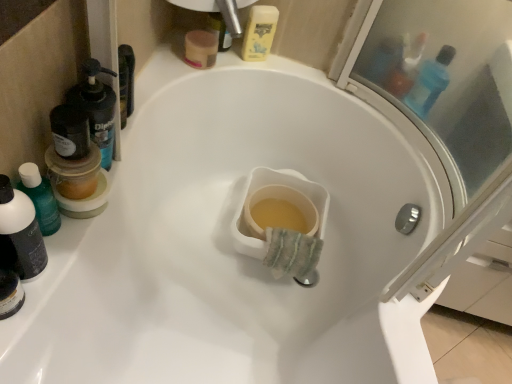
What do you see at coordinates (20, 233) in the screenshot? I see `translucent plastic mouthwash at left, acting as the 1th mouthwash starting from the bottom` at bounding box center [20, 233].

How much space does yellow plastic mouthwash at upper center, which is the fourth mouthwash in front-to-back order, occupy vertically?

yellow plastic mouthwash at upper center, which is the fourth mouthwash in front-to-back order, is 6.24 inches in height.

What is the approximate height of black plastic mouthwash at left, which is the 3th mouthwash in back-to-front order?

black plastic mouthwash at left, which is the 3th mouthwash in back-to-front order, is 10.17 inches tall.

This screenshot has height=384, width=512. What do you see at coordinates (430, 82) in the screenshot? I see `blue translucent bottle at upper right, the 3th mouthwash positioned from the front` at bounding box center [430, 82].

Where is `translucent plastic mouthwash at left, acting as the 1th mouthwash starting from the bottom`? The height and width of the screenshot is (384, 512). translucent plastic mouthwash at left, acting as the 1th mouthwash starting from the bottom is located at coordinates (20, 233).

Is black plastic mouthwash at left, the 3th mouthwash when ordered from top to bottom, at the back of yellow plastic mouthwash at upper center, which is the first mouthwash in top-to-bottom order?

No, yellow plastic mouthwash at upper center, which is the first mouthwash in top-to-bottom order, is not facing away from black plastic mouthwash at left, the 3th mouthwash when ordered from top to bottom.

Considering the relative positions of yellow plastic mouthwash at upper center, which ranks as the 3th mouthwash in left-to-right order, and black plastic mouthwash at left, the second mouthwash ordered from the bottom, in the image provided, is yellow plastic mouthwash at upper center, which ranks as the 3th mouthwash in left-to-right order, to the left or to the right of black plastic mouthwash at left, the second mouthwash ordered from the bottom,?

yellow plastic mouthwash at upper center, which ranks as the 3th mouthwash in left-to-right order, is to the right of black plastic mouthwash at left, the second mouthwash ordered from the bottom.

Measure the distance from yellow plastic mouthwash at upper center, which is the second mouthwash from right to left, to black plastic mouthwash at left, the 3th mouthwash when ordered from top to bottom.

The distance of yellow plastic mouthwash at upper center, which is the second mouthwash from right to left, from black plastic mouthwash at left, the 3th mouthwash when ordered from top to bottom, is 22.48 inches.

Looking at this image, is yellow plastic mouthwash at upper center, which ranks as the 3th mouthwash in left-to-right order, positioned far away from black plastic mouthwash at left, the second mouthwash positioned from the left?

No, yellow plastic mouthwash at upper center, which ranks as the 3th mouthwash in left-to-right order, is not far away from black plastic mouthwash at left, the second mouthwash positioned from the left.

Which of these two, black plastic mouthwash at left, the 3th mouthwash when ordered from top to bottom, or translucent plastic mouthwash at left, the fourth mouthwash when ordered from back to front, is smaller?

Smaller between the two is translucent plastic mouthwash at left, the fourth mouthwash when ordered from back to front.

Measure the distance from black plastic mouthwash at left, the second mouthwash positioned from the front, to translucent plastic mouthwash at left, acting as the 1th mouthwash starting from the bottom.

They are 7.87 inches apart.

From the image's perspective, is black plastic mouthwash at left, the second mouthwash positioned from the left, under translucent plastic mouthwash at left, the fourth mouthwash viewed from the right?

Actually, black plastic mouthwash at left, the second mouthwash positioned from the left, appears above translucent plastic mouthwash at left, the fourth mouthwash viewed from the right, in the image.

How different are the orientations of black plastic mouthwash at left, the 3th mouthwash when ordered from top to bottom, and translucent plastic mouthwash at left, acting as the 1th mouthwash starting from the bottom, in degrees?

1.33e-05 degrees separate the facing orientations of black plastic mouthwash at left, the 3th mouthwash when ordered from top to bottom, and translucent plastic mouthwash at left, acting as the 1th mouthwash starting from the bottom.

Is black plastic mouthwash at left, the 3th mouthwash when ordered from top to bottom, aimed at yellow plastic mouthwash at upper center, positioned as the 1th mouthwash in back-to-front order?

No, black plastic mouthwash at left, the 3th mouthwash when ordered from top to bottom, is not aimed at yellow plastic mouthwash at upper center, positioned as the 1th mouthwash in back-to-front order.

Is black plastic mouthwash at left, the second mouthwash positioned from the front, in front of or behind yellow plastic mouthwash at upper center, the fourth mouthwash when ordered from bottom to top, in the image?

Visually, black plastic mouthwash at left, the second mouthwash positioned from the front, is located in front of yellow plastic mouthwash at upper center, the fourth mouthwash when ordered from bottom to top.

Does point (89, 124) come closer to viewer compared to point (249, 18)?

That is True.

Which of these two, black plastic mouthwash at left, which is the 3th mouthwash in back-to-front order, or yellow plastic mouthwash at upper center, which is the first mouthwash in top-to-bottom order, is smaller?

yellow plastic mouthwash at upper center, which is the first mouthwash in top-to-bottom order.

Could you tell me if translucent plastic mouthwash at left, the fourth mouthwash when ordered from back to front, is turned towards black plastic mouthwash at left, the 3th mouthwash when ordered from top to bottom?

No, translucent plastic mouthwash at left, the fourth mouthwash when ordered from back to front, is not oriented towards black plastic mouthwash at left, the 3th mouthwash when ordered from top to bottom.

Is translucent plastic mouthwash at left, the fourth mouthwash viewed from the right, at the right side of black plastic mouthwash at left, the second mouthwash positioned from the left?

In fact, translucent plastic mouthwash at left, the fourth mouthwash viewed from the right, is to the left of black plastic mouthwash at left, the second mouthwash positioned from the left.

Locate an element on the screen. This screenshot has width=512, height=384. mouthwash that is on the left side of black plastic mouthwash at left, the second mouthwash ordered from the bottom is located at coordinates (20, 233).

Is black plastic mouthwash at left, which is the 3th mouthwash in back-to-front order, inside translucent plastic mouthwash at left, the fourth mouthwash viewed from the right?

No, black plastic mouthwash at left, which is the 3th mouthwash in back-to-front order, is not inside translucent plastic mouthwash at left, the fourth mouthwash viewed from the right.

Which of these two, blue translucent bottle at upper right, which ranks as the 2th mouthwash in back-to-front order, or translucent plastic mouthwash at left, which is the fourth mouthwash in top-to-bottom order, is bigger?

blue translucent bottle at upper right, which ranks as the 2th mouthwash in back-to-front order, is bigger.

In terms of width, does blue translucent bottle at upper right, which appears as the fourth mouthwash when viewed from the left, look wider or thinner when compared to translucent plastic mouthwash at left, the fourth mouthwash viewed from the right?

Clearly, blue translucent bottle at upper right, which appears as the fourth mouthwash when viewed from the left, has more width compared to translucent plastic mouthwash at left, the fourth mouthwash viewed from the right.

Is blue translucent bottle at upper right, which is counted as the 1th mouthwash, starting from the right, looking in the opposite direction of translucent plastic mouthwash at left, which appears as the first mouthwash when viewed from the left?

blue translucent bottle at upper right, which is counted as the 1th mouthwash, starting from the right, is not turned away from translucent plastic mouthwash at left, which appears as the first mouthwash when viewed from the left.

Is blue translucent bottle at upper right, which appears as the fourth mouthwash when viewed from the left, directly adjacent to translucent plastic mouthwash at left, the fourth mouthwash viewed from the right?

blue translucent bottle at upper right, which appears as the fourth mouthwash when viewed from the left, is not next to translucent plastic mouthwash at left, the fourth mouthwash viewed from the right, and they're not touching.

From the image's perspective, which mouthwash is the 3rd one above the translucent plastic mouthwash at left, acting as the 1th mouthwash starting from the bottom? Please provide its 2D coordinates.

[(259, 33)]

Which is behind, point (29, 220) or point (255, 21)?

The point (255, 21) is farther.

Is translucent plastic mouthwash at left, the first mouthwash positioned from the front, positioned with its back to yellow plastic mouthwash at upper center, which is the fourth mouthwash in front-to-back order?

No, translucent plastic mouthwash at left, the first mouthwash positioned from the front, is not facing the opposite direction of yellow plastic mouthwash at upper center, which is the fourth mouthwash in front-to-back order.

Measure the distance from translucent plastic mouthwash at left, the fourth mouthwash when ordered from back to front, to yellow plastic mouthwash at upper center, which is the second mouthwash from right to left.

A distance of 31.68 inches exists between translucent plastic mouthwash at left, the fourth mouthwash when ordered from back to front, and yellow plastic mouthwash at upper center, which is the second mouthwash from right to left.

Consider the image. Which of these two, yellow plastic mouthwash at upper center, which ranks as the 3th mouthwash in left-to-right order, or blue translucent bottle at upper right, which is counted as the 3th mouthwash, starting from the bottom, stands taller?

Standing taller between the two is blue translucent bottle at upper right, which is counted as the 3th mouthwash, starting from the bottom.

Does point (255, 47) appear closer or farther from the camera than point (417, 99)?

Point (255, 47) appears to be farther away from the viewer than point (417, 99).

From the picture: From a real-world perspective, does yellow plastic mouthwash at upper center, the fourth mouthwash when ordered from bottom to top, stand above blue translucent bottle at upper right, which is counted as the 3th mouthwash, starting from the bottom?

No, from a real-world perspective, yellow plastic mouthwash at upper center, the fourth mouthwash when ordered from bottom to top, is not above blue translucent bottle at upper right, which is counted as the 3th mouthwash, starting from the bottom.

The height and width of the screenshot is (384, 512). I want to click on the 2nd mouthwash below the yellow plastic mouthwash at upper center, which is the fourth mouthwash in front-to-back order (from the image's perspective), so click(x=97, y=107).

From a real-world perspective, starting from the black plastic mouthwash at left, the second mouthwash positioned from the front, which mouthwash is the 1st one below it? Please provide its 2D coordinates.

[(20, 233)]

From the picture: Based on their spatial positions, is blue translucent bottle at upper right, the 2th mouthwash when ordered from top to bottom, or yellow plastic mouthwash at upper center, positioned as the 1th mouthwash in back-to-front order, further from translucent plastic mouthwash at left, which appears as the first mouthwash when viewed from the left?

blue translucent bottle at upper right, the 2th mouthwash when ordered from top to bottom, is further to translucent plastic mouthwash at left, which appears as the first mouthwash when viewed from the left.

Looking at the image, which one is located closer to translucent plastic mouthwash at left, the fourth mouthwash viewed from the right, blue translucent bottle at upper right, which is counted as the 3th mouthwash, starting from the bottom, or black plastic mouthwash at left, which is the 3th mouthwash in back-to-front order?

black plastic mouthwash at left, which is the 3th mouthwash in back-to-front order, lies closer to translucent plastic mouthwash at left, the fourth mouthwash viewed from the right, than the other object.

Estimate the real-world distances between objects in this image. Which object is further from yellow plastic mouthwash at upper center, which is the fourth mouthwash in front-to-back order, black plastic mouthwash at left, the second mouthwash ordered from the bottom, or translucent plastic mouthwash at left, the fourth mouthwash viewed from the right?

translucent plastic mouthwash at left, the fourth mouthwash viewed from the right.

From the image, which object appears to be farther from yellow plastic mouthwash at upper center, which is the second mouthwash from right to left, translucent plastic mouthwash at left, which is the fourth mouthwash in top-to-bottom order, or blue translucent bottle at upper right, the 2th mouthwash when ordered from top to bottom?

The object further to yellow plastic mouthwash at upper center, which is the second mouthwash from right to left, is translucent plastic mouthwash at left, which is the fourth mouthwash in top-to-bottom order.

From the image, which object appears to be nearer to black plastic mouthwash at left, the third mouthwash viewed from the right, blue translucent bottle at upper right, which is counted as the 3th mouthwash, starting from the bottom, or yellow plastic mouthwash at upper center, which is the fourth mouthwash in front-to-back order?

yellow plastic mouthwash at upper center, which is the fourth mouthwash in front-to-back order, is positioned closer to the anchor black plastic mouthwash at left, the third mouthwash viewed from the right.

Considering their positions, is translucent plastic mouthwash at left, acting as the 1th mouthwash starting from the bottom, positioned further to yellow plastic mouthwash at upper center, which is the first mouthwash in top-to-bottom order, than black plastic mouthwash at left, the second mouthwash positioned from the front?

translucent plastic mouthwash at left, acting as the 1th mouthwash starting from the bottom, is further to yellow plastic mouthwash at upper center, which is the first mouthwash in top-to-bottom order.

Considering their positions, is translucent plastic mouthwash at left, which appears as the first mouthwash when viewed from the left, positioned further to black plastic mouthwash at left, the second mouthwash positioned from the front, than yellow plastic mouthwash at upper center, which is the fourth mouthwash in front-to-back order?

Among the two, yellow plastic mouthwash at upper center, which is the fourth mouthwash in front-to-back order, is located further to black plastic mouthwash at left, the second mouthwash positioned from the front.

Considering their positions, is yellow plastic mouthwash at upper center, which is the second mouthwash from right to left, positioned further to black plastic mouthwash at left, the second mouthwash ordered from the bottom, than blue translucent bottle at upper right, the 2th mouthwash when ordered from top to bottom?

blue translucent bottle at upper right, the 2th mouthwash when ordered from top to bottom, is positioned further to the anchor black plastic mouthwash at left, the second mouthwash ordered from the bottom.

The width and height of the screenshot is (512, 384). I want to click on mouthwash between black plastic mouthwash at left, the second mouthwash ordered from the bottom, and blue translucent bottle at upper right, which ranks as the 2th mouthwash in back-to-front order, so click(x=259, y=33).